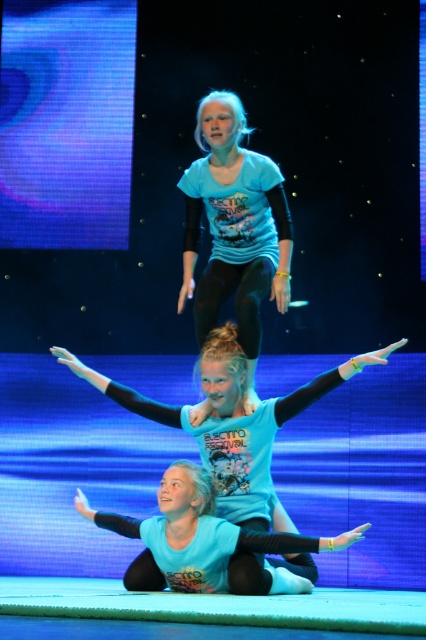
Question: Does matte blue t-shirt at center appear on the right side of matte blue leggings at lower center?

Choices:
 (A) no
 (B) yes

Answer: (B)

Question: Is matte blue leotard at center smaller than matte blue t-shirt at center?

Choices:
 (A) yes
 (B) no

Answer: (B)

Question: Based on their relative distances, which object is nearer to the matte blue t-shirt at center?

Choices:
 (A) matte blue leggings at lower center
 (B) matte blue leotard at center

Answer: (B)

Question: Which object is farther from the camera taking this photo?

Choices:
 (A) matte blue leotard at center
 (B) matte blue leggings at lower center

Answer: (B)

Question: In this image, where is matte blue leotard at center located relative to matte blue leggings at lower center?

Choices:
 (A) below
 (B) above

Answer: (B)

Question: Which point is closer to the camera?

Choices:
 (A) matte blue leggings at lower center
 (B) matte blue leotard at center
 (C) matte blue t-shirt at center

Answer: (B)